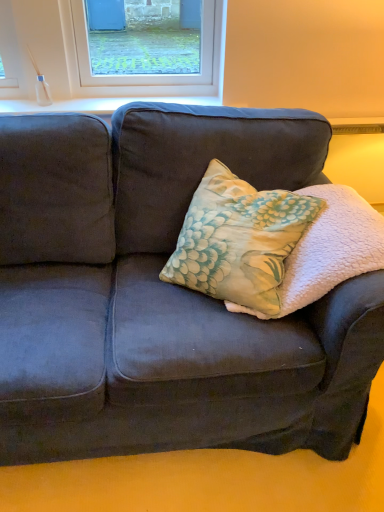
Question: Is floral fabric pillow at center with white smooth window sill at upper center?

Choices:
 (A) no
 (B) yes

Answer: (A)

Question: From the image's perspective, is floral fabric pillow at center located above white smooth window sill at upper center?

Choices:
 (A) yes
 (B) no

Answer: (B)

Question: Is floral fabric pillow at center at the left side of white smooth window sill at upper center?

Choices:
 (A) no
 (B) yes

Answer: (A)

Question: Is floral fabric pillow at center turned away from white smooth window sill at upper center?

Choices:
 (A) yes
 (B) no

Answer: (B)

Question: Is floral fabric pillow at center thinner than white smooth window sill at upper center?

Choices:
 (A) no
 (B) yes

Answer: (A)

Question: Is velvet dark blue couch at center wider or thinner than white smooth window sill at upper center?

Choices:
 (A) thin
 (B) wide

Answer: (B)

Question: From a real-world perspective, is velvet dark blue couch at center physically located above or below white smooth window sill at upper center?

Choices:
 (A) above
 (B) below

Answer: (B)

Question: Based on their positions, is velvet dark blue couch at center located to the left or right of white smooth window sill at upper center?

Choices:
 (A) right
 (B) left

Answer: (A)

Question: Considering their positions, is velvet dark blue couch at center located in front of or behind white smooth window sill at upper center?

Choices:
 (A) front
 (B) behind

Answer: (A)

Question: Is floral fabric pillow at center wider or thinner than white smooth window sill at upper center?

Choices:
 (A) wide
 (B) thin

Answer: (A)

Question: From the image's perspective, is floral fabric pillow at center above or below white smooth window sill at upper center?

Choices:
 (A) below
 (B) above

Answer: (A)

Question: Is floral fabric pillow at center spatially inside white smooth window sill at upper center, or outside of it?

Choices:
 (A) inside
 (B) outside

Answer: (B)

Question: Is point (327, 268) closer or farther from the camera than point (23, 111)?

Choices:
 (A) closer
 (B) farther

Answer: (A)

Question: Looking at the image, does velvet dark blue couch at center seem bigger or smaller compared to floral fabric pillow at center?

Choices:
 (A) big
 (B) small

Answer: (B)

Question: Looking at their shapes, would you say velvet dark blue couch at center is wider or thinner than floral fabric pillow at center?

Choices:
 (A) thin
 (B) wide

Answer: (B)